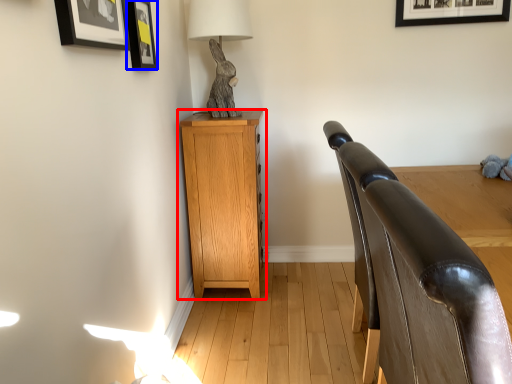
Question: Which of the following is the farthest to the observer, nightstand (highlighted by a red box) or picture frame (highlighted by a blue box)?

Choices:
 (A) nightstand
 (B) picture frame

Answer: (A)